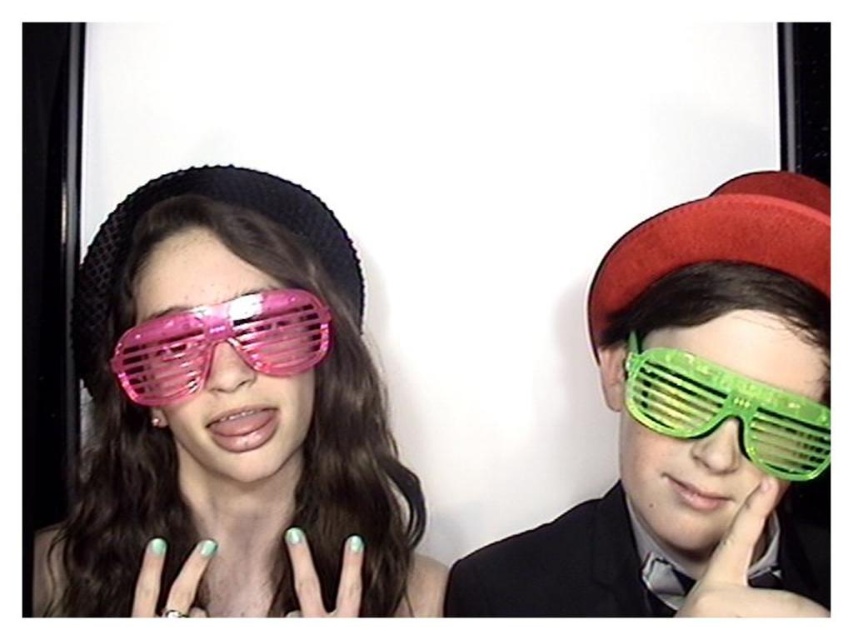
Question: Does red matte hat at upper right appear on the left side of teal matte nails at center?

Choices:
 (A) no
 (B) yes

Answer: (A)

Question: Is the position of red matte hat at upper right less distant than that of pink plastic goggles at center?

Choices:
 (A) no
 (B) yes

Answer: (B)

Question: Considering the real-world distances, which object is closest to the green matte nails at center?

Choices:
 (A) teal matte nails at center
 (B) red matte hat at upper right
 (C) green plastic glasses at right
 (D) pink plastic glasses at center

Answer: (A)

Question: Is pink plastic goggles at center above green plastic hand at right?

Choices:
 (A) no
 (B) yes

Answer: (B)

Question: Which object is farther from the camera taking this photo?

Choices:
 (A) pink plastic glasses at left
 (B) pink plastic glasses at center

Answer: (B)

Question: Considering the real-world distances, which object is farthest from the pink plastic goggles at center?

Choices:
 (A) pink plastic glasses at center
 (B) green matte nails at center
 (C) red matte hat at upper right
 (D) teal matte nails at center

Answer: (C)